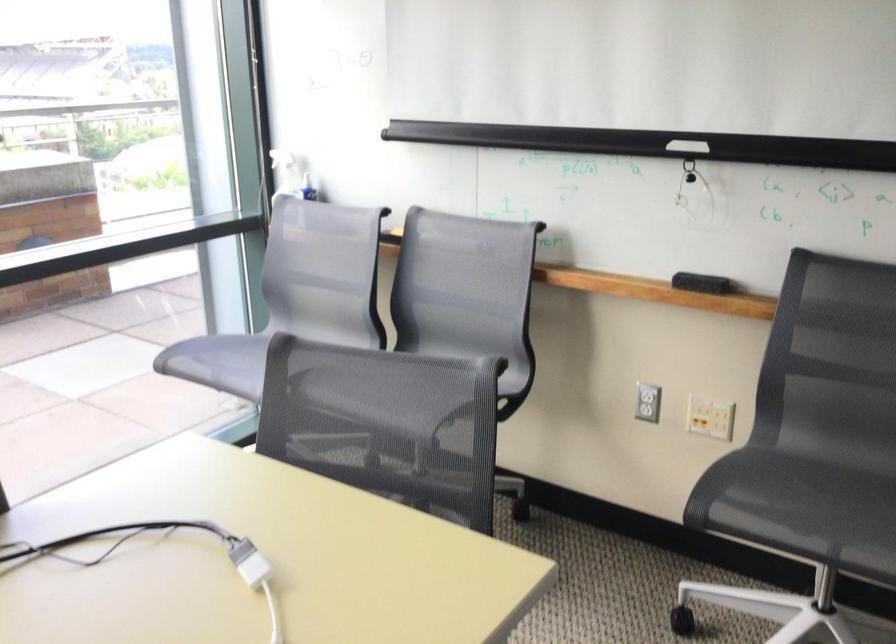
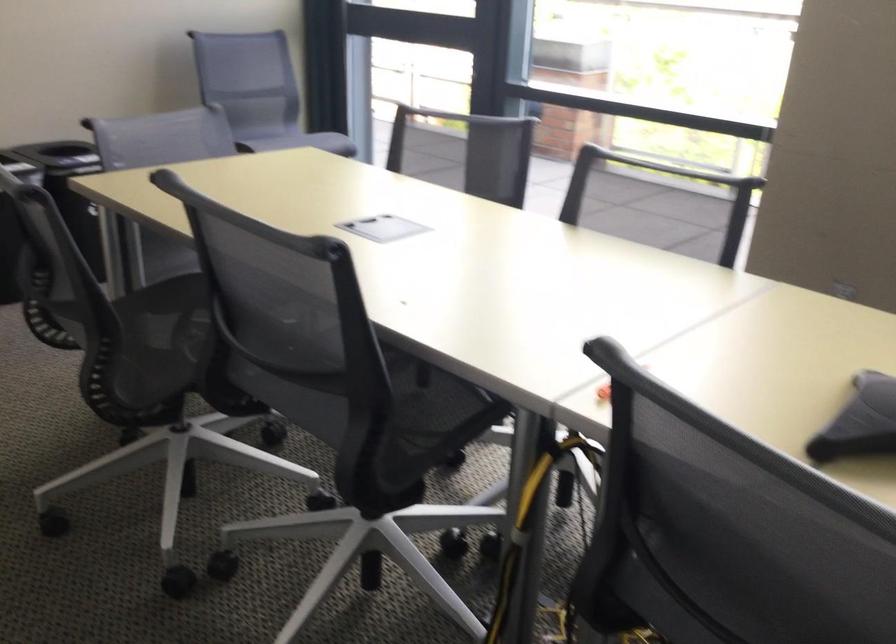
The images are taken continuously from a first-person perspective. In which direction is your viewpoint rotating?

The rotation direction of the camera is left-down.